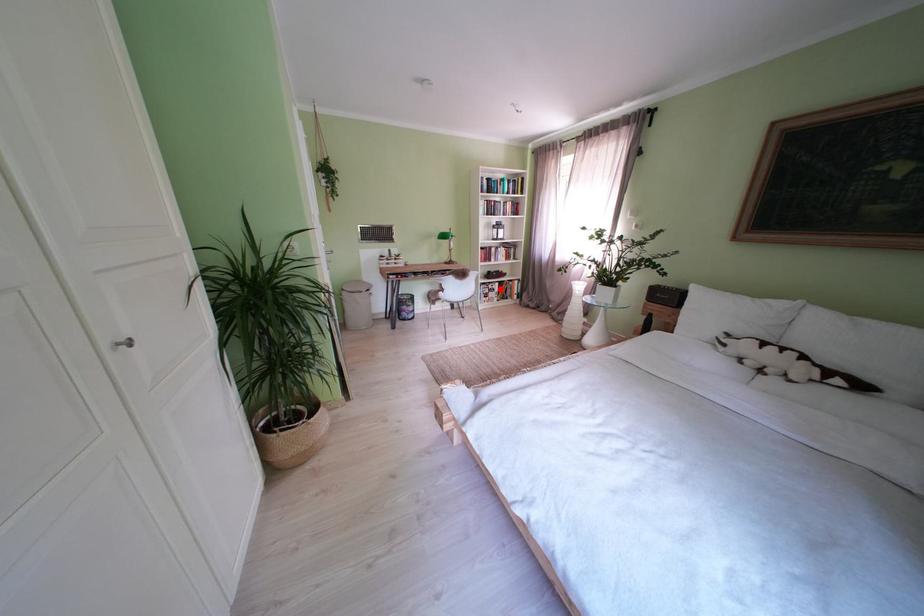
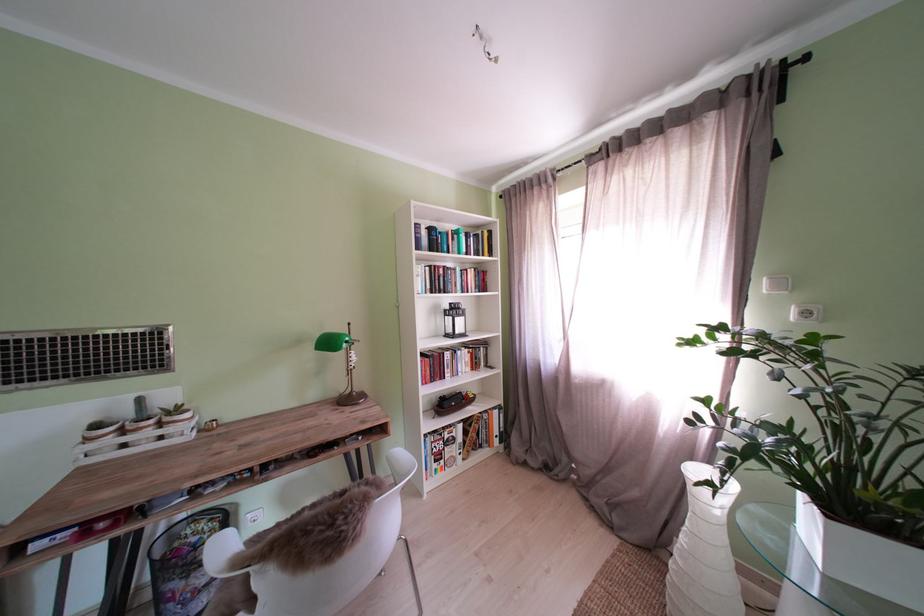
Locate, in the second image, the point that corresponds to the highlighted location in the first image.

(456, 434)